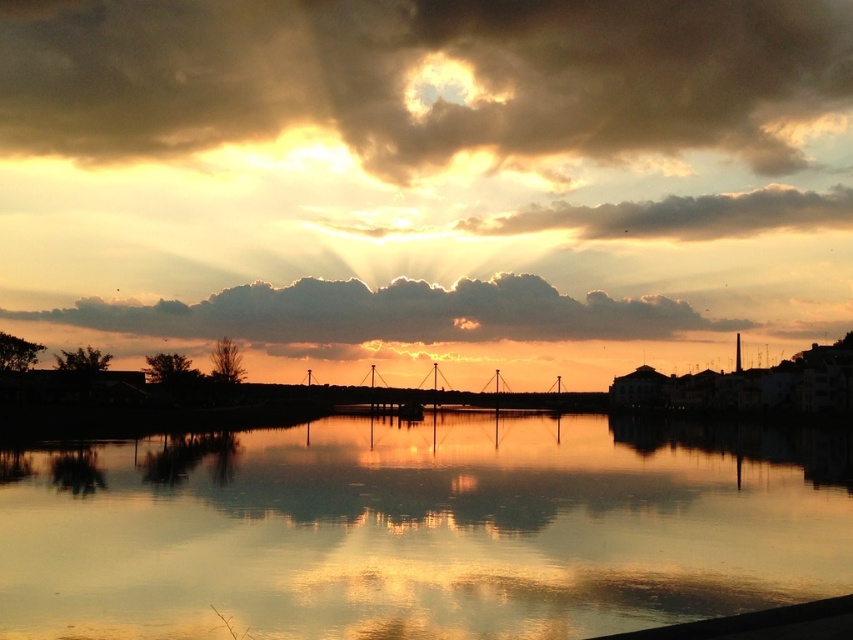
Based on the photo, measure the distance from silky smooth water at center to dark gray cloud at upper center.

silky smooth water at center and dark gray cloud at upper center are 743.14 feet apart from each other.

This screenshot has width=853, height=640. Describe the element at coordinates (421, 529) in the screenshot. I see `silky smooth water at center` at that location.

Where is `silky smooth water at center`? silky smooth water at center is located at coordinates (421, 529).

Is cloudy sky at upper center thinner than cloudy sky at center?

In fact, cloudy sky at upper center might be wider than cloudy sky at center.

Is cloudy sky at upper center wider than cloudy sky at center?

Indeed, cloudy sky at upper center has a greater width compared to cloudy sky at center.

Find the location of a particular element. This screenshot has height=640, width=853. cloudy sky at upper center is located at coordinates (422, 77).

Consider the image. Does cloudy sky at upper center have a lesser width compared to dark gray cloud at upper center?

Incorrect, cloudy sky at upper center's width is not less than dark gray cloud at upper center's.

Between cloudy sky at upper center and dark gray cloud at upper center, which one is positioned lower?

Positioned lower is dark gray cloud at upper center.

In order to click on cloudy sky at upper center in this screenshot , I will do `click(422, 77)`.

The height and width of the screenshot is (640, 853). I want to click on cloudy sky at upper center, so click(x=422, y=77).